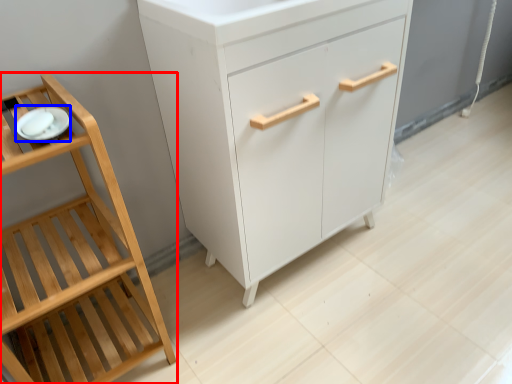
Question: Which of the following is the closest to the observer, furniture (highlighted by a red box) or tableware (highlighted by a blue box)?

Choices:
 (A) furniture
 (B) tableware

Answer: (A)